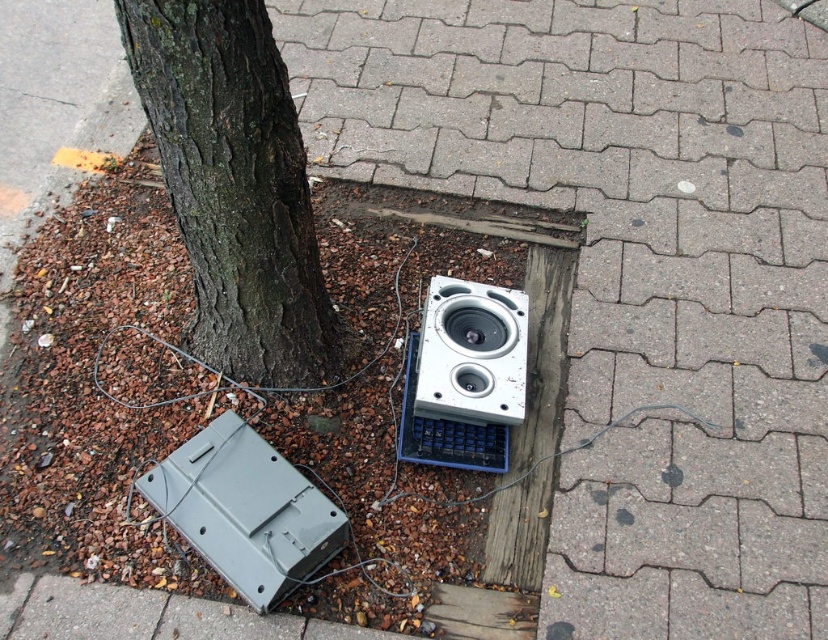
Question: Among these points, which one is farthest from the camera?

Choices:
 (A) (472, 348)
 (B) (145, 4)
 (C) (285, 572)

Answer: (A)

Question: Does dark brown bark at center appear over white plastic speaker at center?

Choices:
 (A) no
 (B) yes

Answer: (B)

Question: Which object appears farthest from the camera in this image?

Choices:
 (A) dark brown bark at center
 (B) white plastic speaker at center
 (C) gray matte television at lower left

Answer: (B)

Question: Is gray matte television at lower left above white plastic speaker at center?

Choices:
 (A) yes
 (B) no

Answer: (B)

Question: Among these points, which one is farthest from the camera?

Choices:
 (A) (258, 465)
 (B) (509, 378)
 (C) (258, 156)

Answer: (B)

Question: Does dark brown bark at center have a larger size compared to white plastic speaker at center?

Choices:
 (A) no
 (B) yes

Answer: (B)